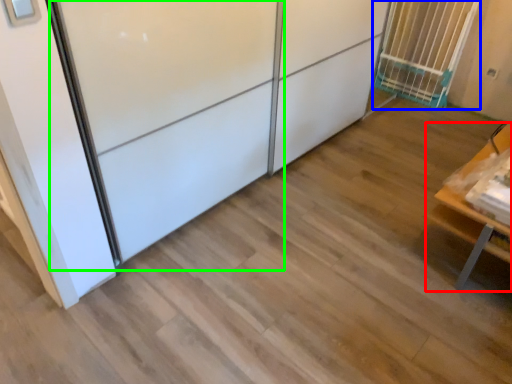
Question: Which is farther away from furniture (highlighted by a red box)? cage (highlighted by a blue box) or screen door (highlighted by a green box)?

Choices:
 (A) cage
 (B) screen door

Answer: (A)